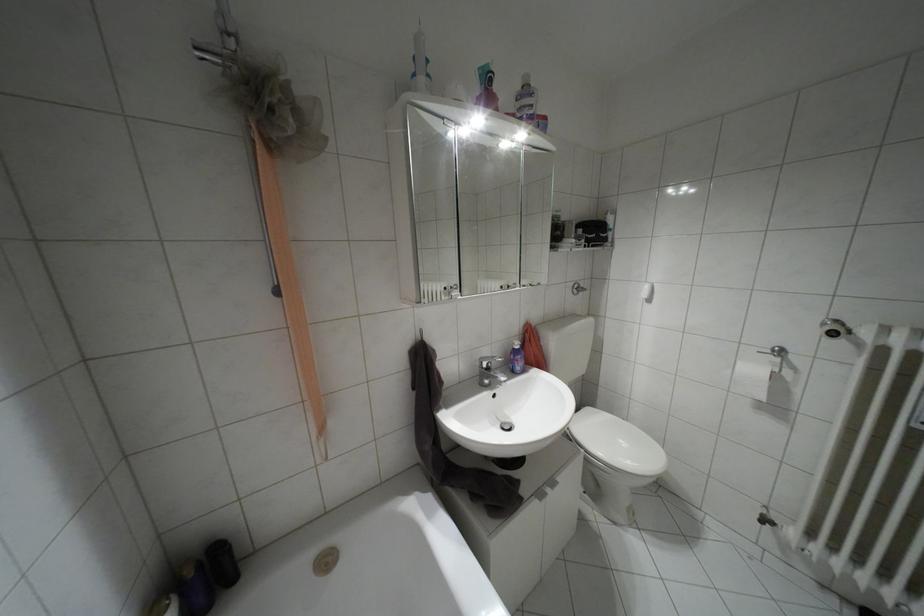
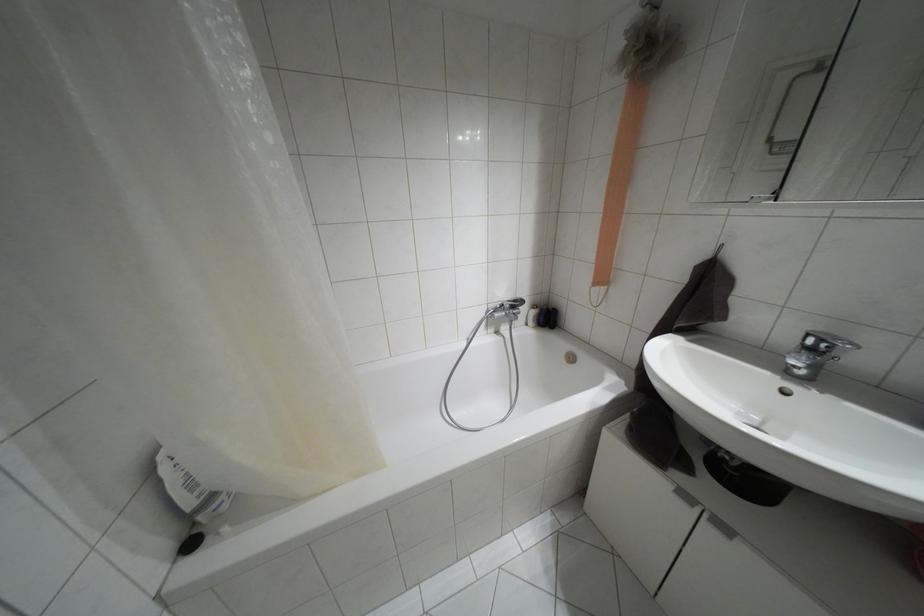
Where in the second image is the point corresponding to pixel 540 493 from the first image?

(685, 496)